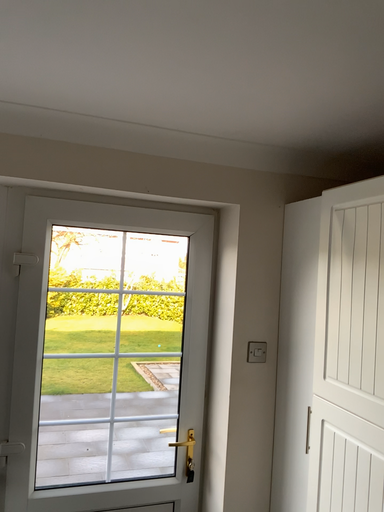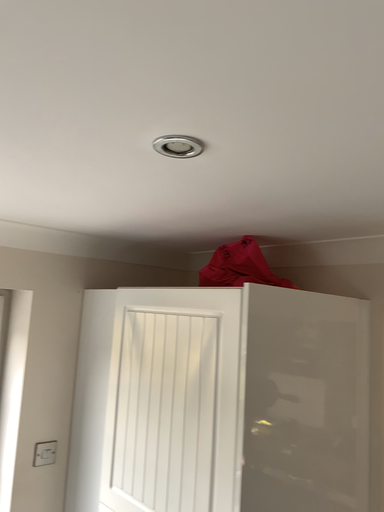
Question: How did the camera likely rotate when shooting the video?

Choices:
 (A) rotated right
 (B) rotated left

Answer: (A)